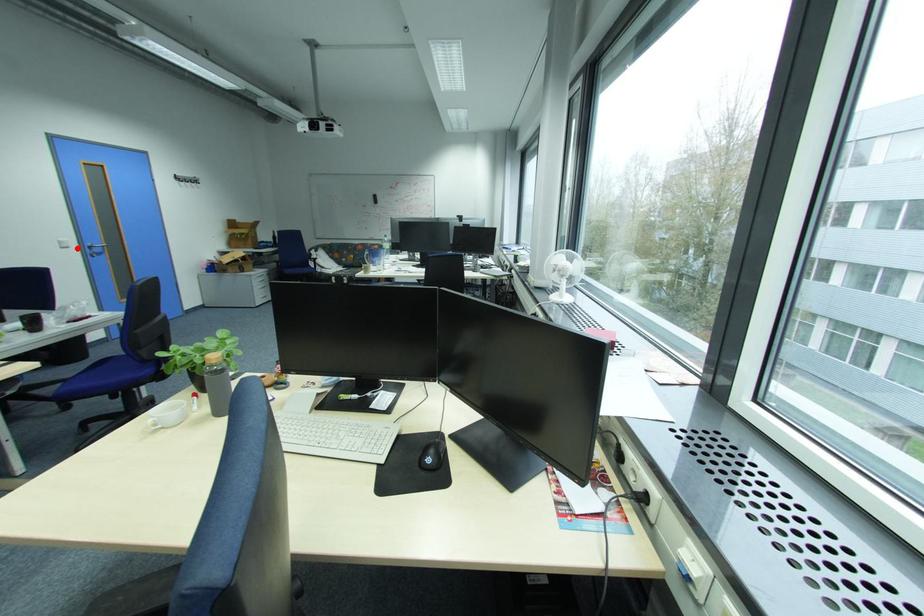
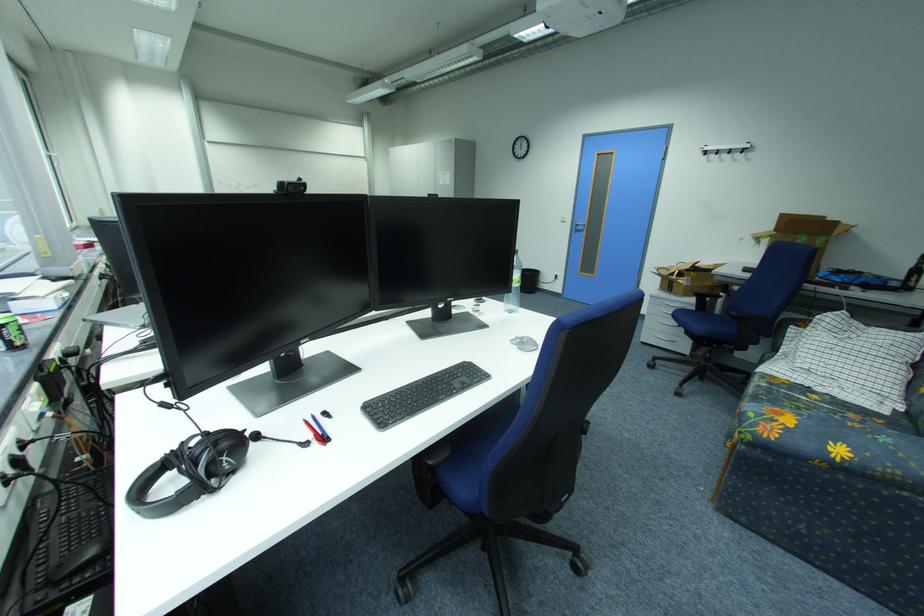
Question: I am providing you with two images of the same scene from different viewpoints. Given a red point in image1, look at the same physical point in image2. Is it:

Choices:
 (A) Closer to the viewpoint
 (B) Farther from the viewpoint

Answer: (A)